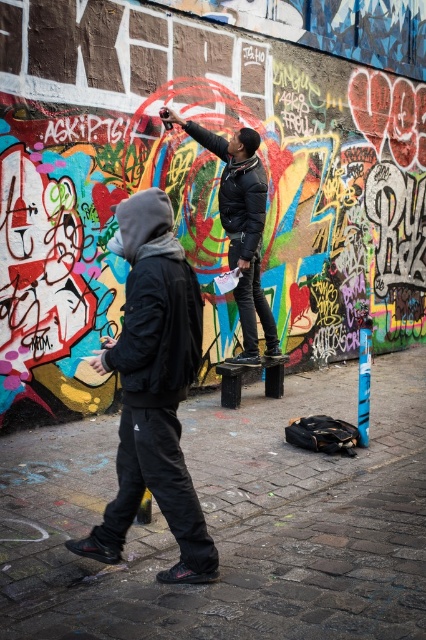
Which is below, dark gray hoodie at left or black leather jacket at center?

dark gray hoodie at left is below.

Between point (158, 468) and point (249, 173), which one is positioned in front?

Point (158, 468) is in front.

Which is in front, point (138, 448) or point (242, 269)?

Point (138, 448) is more forward.

Locate an element on the screen. The width and height of the screenshot is (426, 640). dark gray hoodie at left is located at coordinates (154, 388).